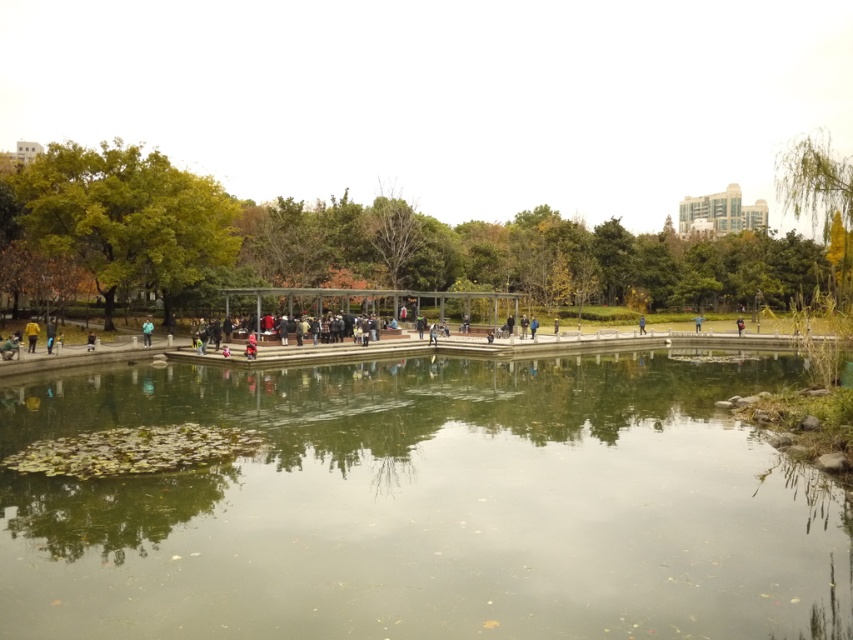
Can you confirm if yellow jacket at left is positioned below green fabric jacket at center?

Indeed, yellow jacket at left is positioned under green fabric jacket at center.

Can you confirm if yellow jacket at left is shorter than green fabric jacket at center?

Yes, yellow jacket at left is shorter than green fabric jacket at center.

What do you see at coordinates (32, 333) in the screenshot? I see `yellow jacket at left` at bounding box center [32, 333].

The height and width of the screenshot is (640, 853). I want to click on yellow jacket at left, so click(32, 333).

Is point (621, 552) farther from camera compared to point (144, 328)?

No, it is in front of (144, 328).

Which is more to the left, green reflective water at center or green fabric jacket at center?

green fabric jacket at center

Between point (664, 580) and point (143, 339), which one is positioned behind?

The point (143, 339) is more distant.

At what (x,y) coordinates should I click in order to perform the action: click on green reflective water at center. Please return your answer as a coordinate pair (x, y). Looking at the image, I should click on (427, 504).

Does green reflective water at center have a lesser height compared to yellow jacket at left?

Yes, green reflective water at center is shorter than yellow jacket at left.

Is green reflective water at center smaller than yellow jacket at left?

No, green reflective water at center is not smaller than yellow jacket at left.

Who is more forward, [225,630] or [39,328]?

Positioned in front is point [225,630].

Locate an element on the screen. The height and width of the screenshot is (640, 853). green reflective water at center is located at coordinates click(427, 504).